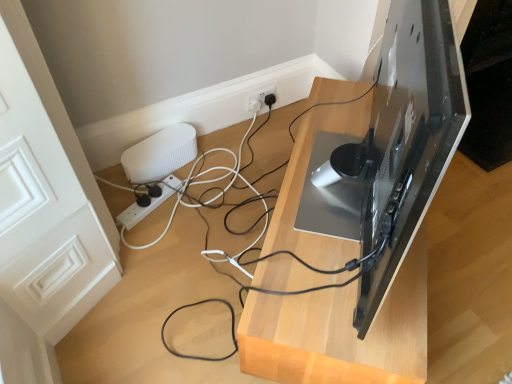
Question: Is white ribbed speaker at lower left behind glossy black monitor at upper right?

Choices:
 (A) yes
 (B) no

Answer: (A)

Question: Is the depth of white ribbed speaker at lower left less than that of glossy black monitor at upper right?

Choices:
 (A) yes
 (B) no

Answer: (B)

Question: Is white ribbed speaker at lower left taller than glossy black monitor at upper right?

Choices:
 (A) no
 (B) yes

Answer: (A)

Question: Is white ribbed speaker at lower left surrounding glossy black monitor at upper right?

Choices:
 (A) no
 (B) yes

Answer: (A)

Question: From a real-world perspective, is white ribbed speaker at lower left below glossy black monitor at upper right?

Choices:
 (A) no
 (B) yes

Answer: (B)

Question: Does white ribbed speaker at lower left have a smaller size compared to glossy black monitor at upper right?

Choices:
 (A) yes
 (B) no

Answer: (A)

Question: Would you say white ribbed speaker at lower left contains white plastic power strip at lower center?

Choices:
 (A) no
 (B) yes

Answer: (A)

Question: Does white ribbed speaker at lower left have a lesser height compared to white plastic power strip at lower center?

Choices:
 (A) no
 (B) yes

Answer: (A)

Question: From a real-world perspective, is white ribbed speaker at lower left over white plastic power strip at lower center?

Choices:
 (A) no
 (B) yes

Answer: (B)

Question: Is white ribbed speaker at lower left completely or partially outside of white plastic power strip at lower center?

Choices:
 (A) yes
 (B) no

Answer: (A)

Question: Are white ribbed speaker at lower left and white plastic power strip at lower center beside each other?

Choices:
 (A) yes
 (B) no

Answer: (B)

Question: Is white ribbed speaker at lower left further to camera compared to white plastic power strip at lower center?

Choices:
 (A) no
 (B) yes

Answer: (B)

Question: Considering the relative sizes of white plastic power strip at lower center and glossy black monitor at upper right in the image provided, is white plastic power strip at lower center thinner than glossy black monitor at upper right?

Choices:
 (A) no
 (B) yes

Answer: (B)